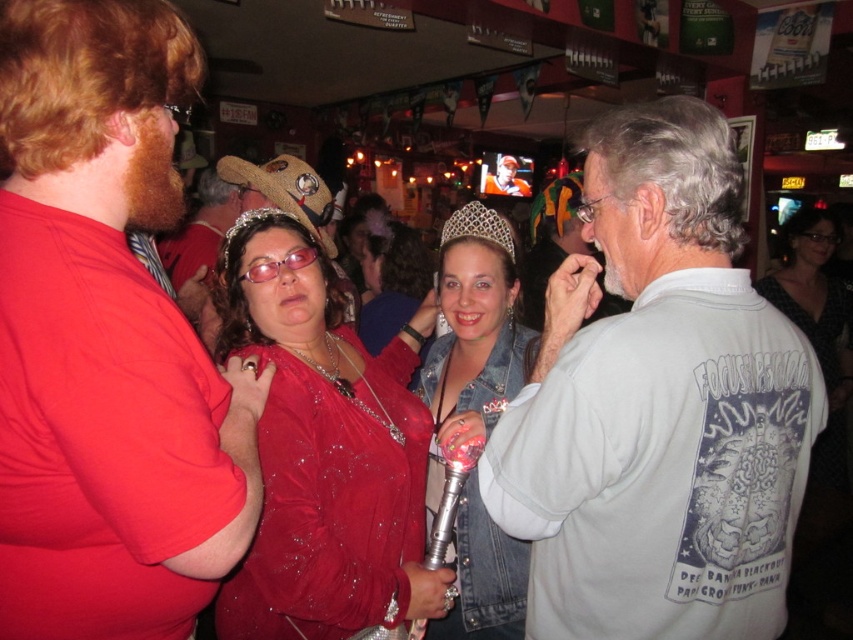
The image size is (853, 640). What do you see at coordinates (323, 451) in the screenshot?
I see `shiny red dress at center` at bounding box center [323, 451].

Who is more distant from viewer, (328,292) or (824,557)?

The point (824,557) is behind.

Where is `shiny red dress at center`? shiny red dress at center is located at coordinates (323, 451).

The height and width of the screenshot is (640, 853). In order to click on shiny red dress at center in this screenshot , I will do `click(323, 451)`.

Can you confirm if matte red shirt at left is positioned above orange fabric shirt at center?

No, matte red shirt at left is not above orange fabric shirt at center.

Does matte red shirt at left lie behind orange fabric shirt at center?

No.

Who is more forward, (149, 180) or (503, 193)?

Positioned in front is point (149, 180).

Identify the location of matte red shirt at left. This screenshot has width=853, height=640. (106, 339).

Is point (78, 289) in front of point (521, 541)?

Yes, point (78, 289) is closer to viewer.

At what (x,y) coordinates should I click in order to perform the action: click on matte red shirt at left. Please return your answer as a coordinate pair (x, y). Looking at the image, I should click on (106, 339).

This screenshot has height=640, width=853. In order to click on matte red shirt at left in this screenshot , I will do `click(106, 339)`.